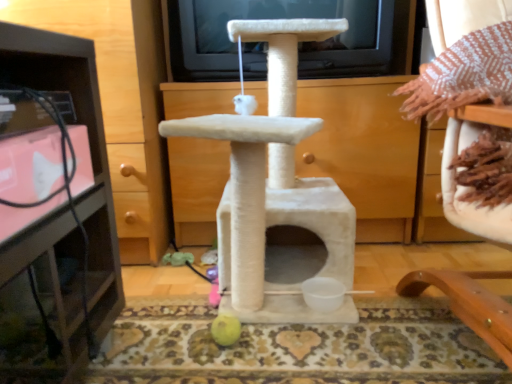
Question: In the image, is brushed metal tv stand at left, which is the second furniture from front to back, positioned in front of or behind beige fabric chair at upper right, the 1th furniture in the right-to-left sequence?

Choices:
 (A) front
 (B) behind

Answer: (B)

Question: Is point (53, 84) positioned closer to the camera than point (494, 119)?

Choices:
 (A) farther
 (B) closer

Answer: (A)

Question: Is brushed metal tv stand at left, the second furniture when ordered from right to left, wider or thinner than beige fabric chair at upper right, which appears as the 1th furniture when viewed from the front?

Choices:
 (A) wide
 (B) thin

Answer: (B)

Question: Is point (480, 289) closer or farther from the camera than point (110, 306)?

Choices:
 (A) closer
 (B) farther

Answer: (A)

Question: Is beige fabric chair at upper right, the second furniture in the left-to-right sequence, bigger or smaller than brushed metal tv stand at left, which ranks as the 1th furniture in back-to-front order?

Choices:
 (A) small
 (B) big

Answer: (A)

Question: Is beige fabric chair at upper right, which is the second furniture from back to front, taller or shorter than brushed metal tv stand at left, the second furniture when ordered from right to left?

Choices:
 (A) tall
 (B) short

Answer: (B)

Question: Looking at their shapes, would you say beige fabric chair at upper right, the second furniture in the left-to-right sequence, is wider or thinner than brushed metal tv stand at left, which is the second furniture from front to back?

Choices:
 (A) wide
 (B) thin

Answer: (A)